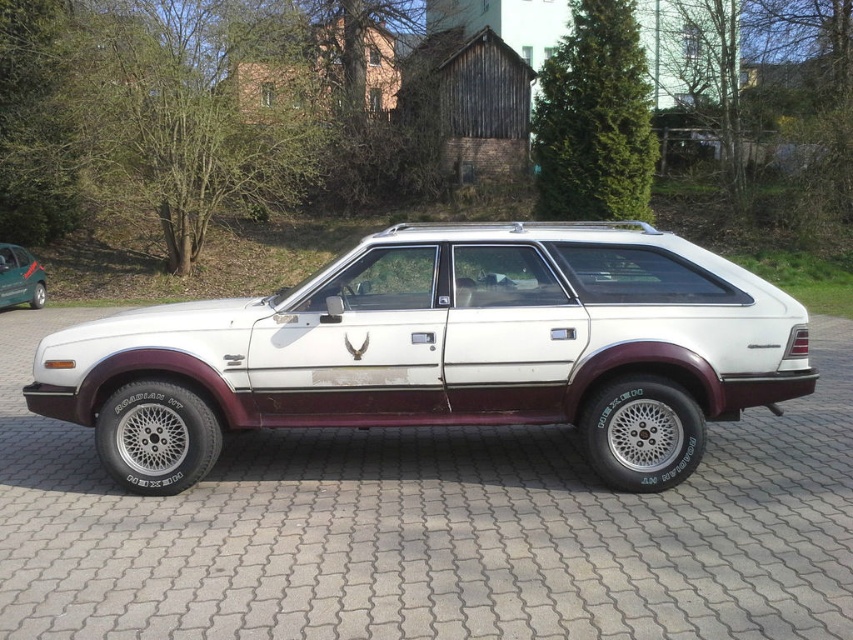
From the picture: You are planning to park your car in the driveway. Based on the image, can the green matte hatchback at left fit entirely on the white paved driveway at center?

The white paved driveway at center is larger in size than the green matte hatchback at left, so yes, the green matte hatchback at left can fit entirely on the white paved driveway at center.

You are a delivery person trying to park your van behind the white matte station wagon at center and the green matte hatchback at left. Which vehicle should you park behind to have more vertical clearance for your van?

The white matte station wagon at center is not as tall as the green matte hatchback at left, so you should park behind the white matte station wagon at center to have more vertical clearance for your van.

You are standing in front of the white matte station wagon at center and want to walk to the white paved driveway at center. In which direction should you walk?

You should walk to the right to reach the white paved driveway at center because the white paved driveway at center is to the left of the white matte station wagon at center, so moving in the opposite direction would lead you there.